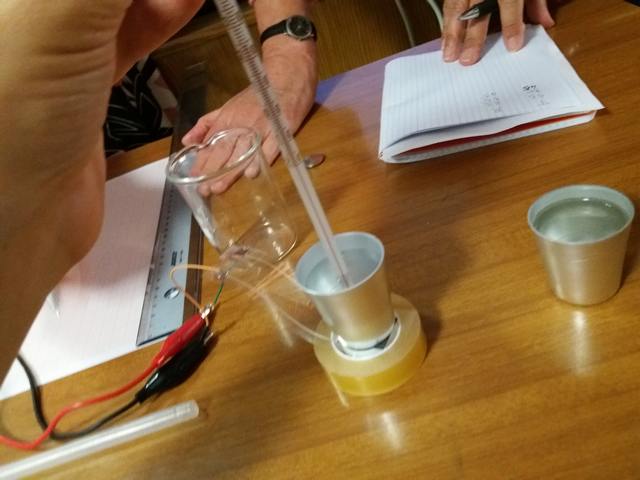
Find the location of a particular element. power cords is located at coordinates (171, 367), (182, 337).